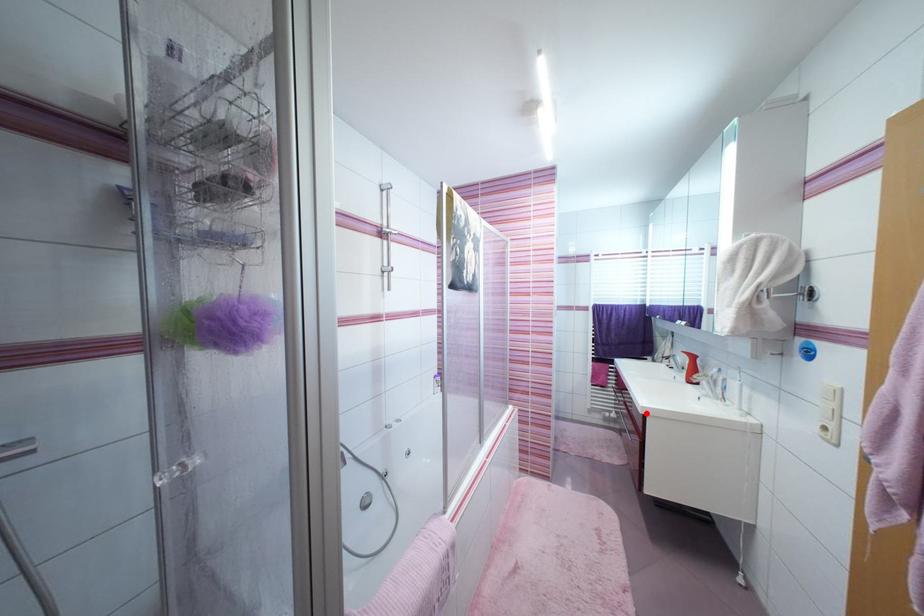
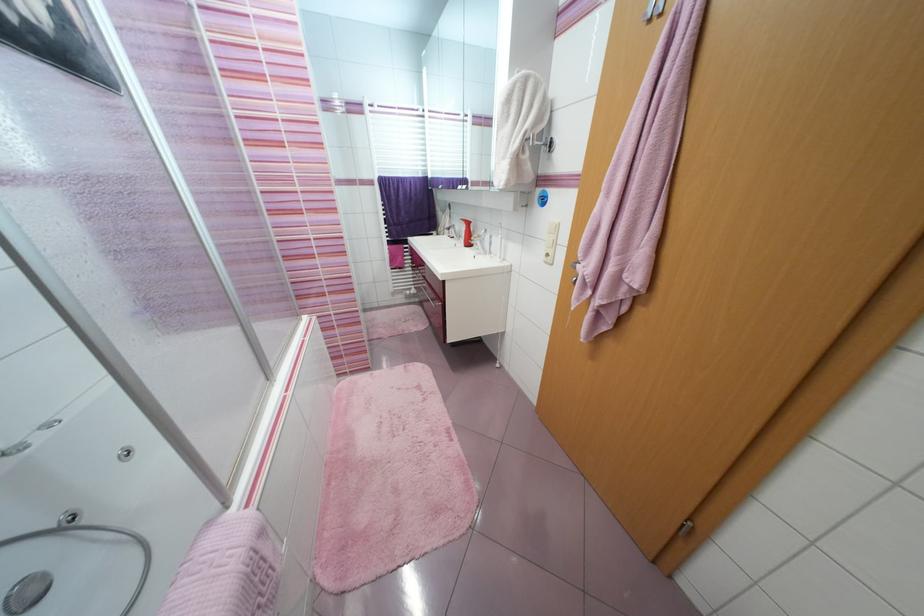
Find the pixel in the second image that matches the highlighted location in the first image.

(445, 281)